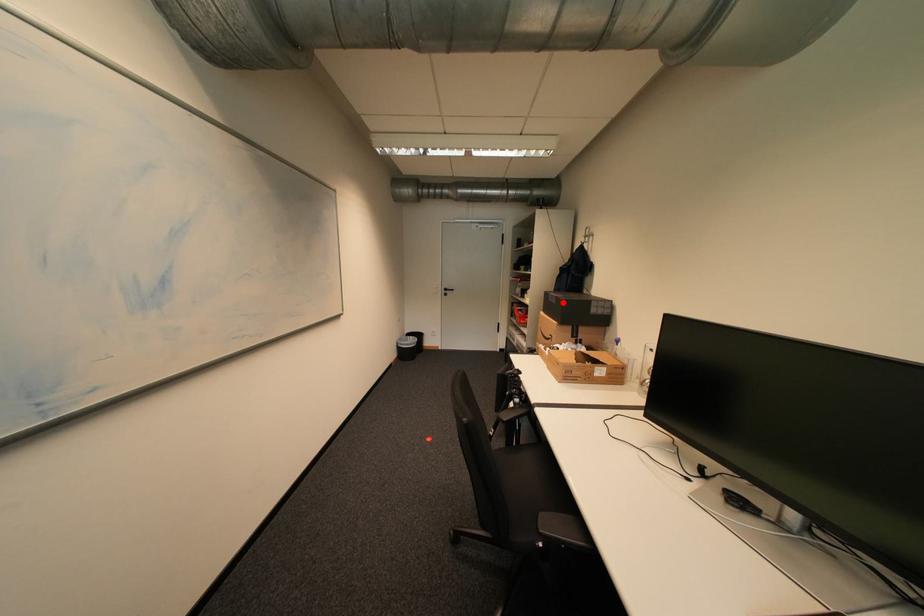
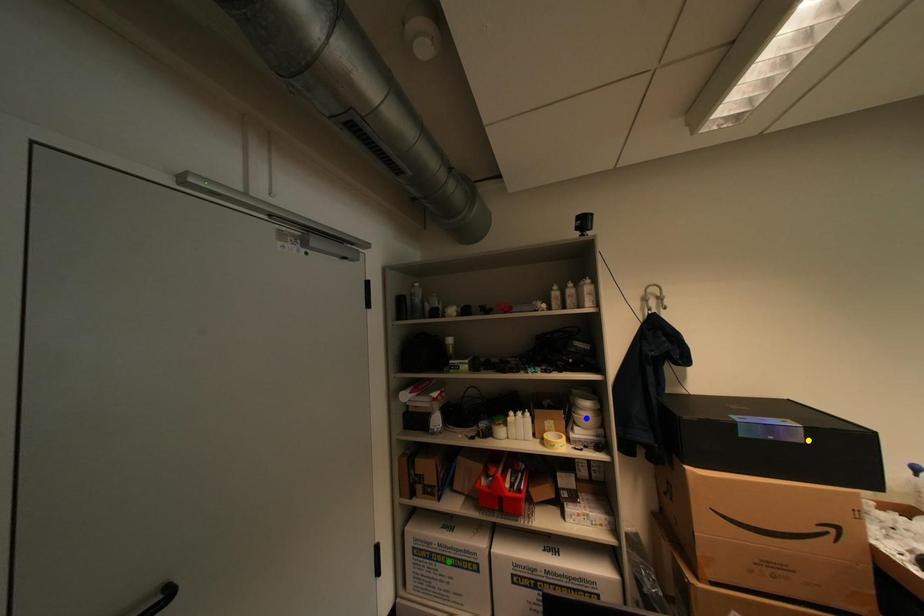
Question: I am providing you with two images of the same scene from different viewpoints. A red point is marked on the first image. You are given multiple points on the second image. Can you choose the point in image 2 that corresponds to the point in image 1?

Choices:
 (A) green point
 (B) blue point
 (C) yellow point

Answer: (C)